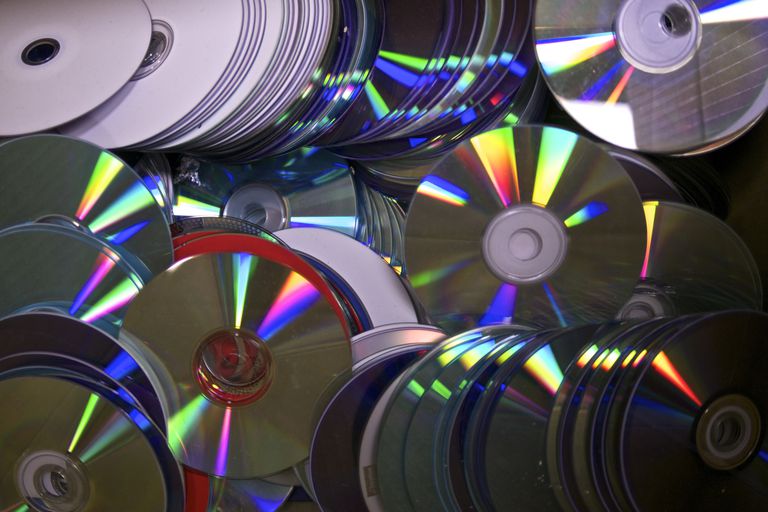
At what (x,y) coordinates should I click in order to perform the action: click on window. Please return your answer as a coordinate pair (x, y). This screenshot has width=768, height=512. Looking at the image, I should click on (686, 101).